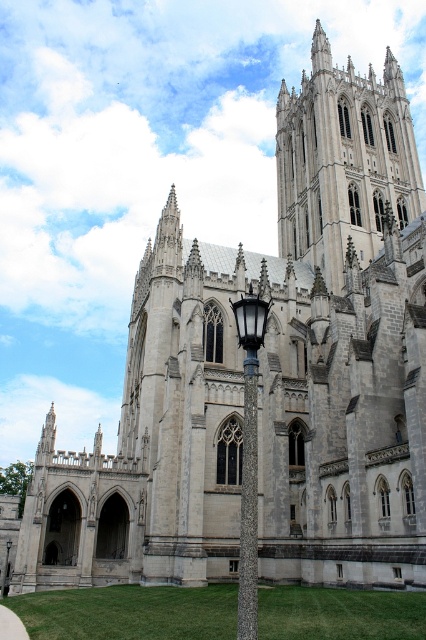
You are a tourist standing in front of the cathedral and want to take a photo that includes both the gray stone tower at upper center and the polished brass lamp post at center. Which object should you position closer to the edge of the frame to ensure both fit in the photo?

Since the gray stone tower at upper center is wider than the polished brass lamp post at center, you should position the gray stone tower at upper center closer to the edge of the frame to ensure both fit in the photo.

You are standing in front of the cathedral and want to take a photo that includes both the gray stone tower at upper center and the polished brass lamp post at center. Based on their positions, which object should appear higher in your photo?

The gray stone tower at upper center should appear higher in the photo because it is positioned above the polished brass lamp post at center.

You are standing in front of the cathedral and want to take a photo of the gray stone tower at upper center and the polished brass lamp post at center. Which object should you focus on first to ensure both are in frame?

You should focus on the gray stone tower at upper center first because it is closer to you than the polished brass lamp post at center, so adjusting the camera to include it first ensures both are in frame.